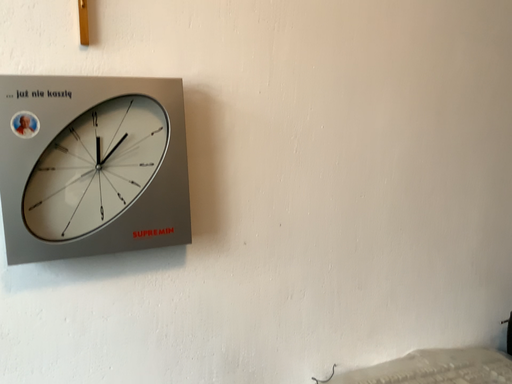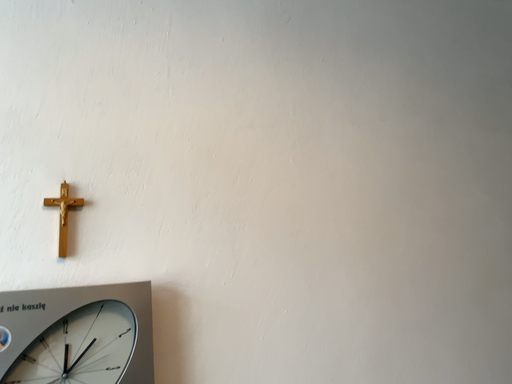
Question: Which way did the camera rotate in the video?

Choices:
 (A) rotated upward
 (B) rotated downward

Answer: (A)